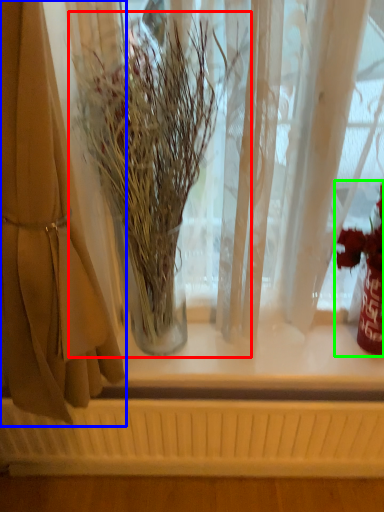
Question: Considering the real-world distances, which object is closest to houseplant (highlighted by a red box)? curtain (highlighted by a blue box) or floral arrangement (highlighted by a green box).

Choices:
 (A) curtain
 (B) floral arrangement

Answer: (A)